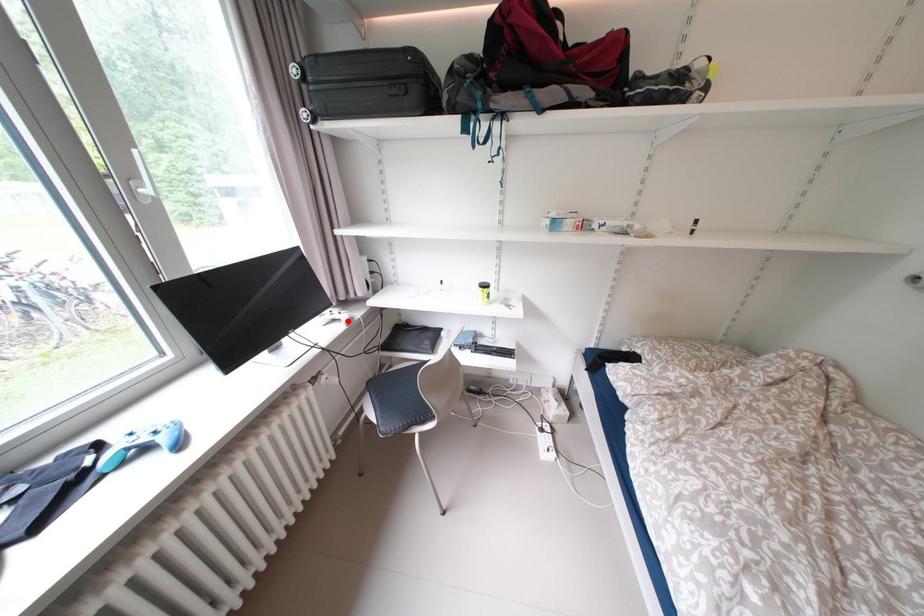
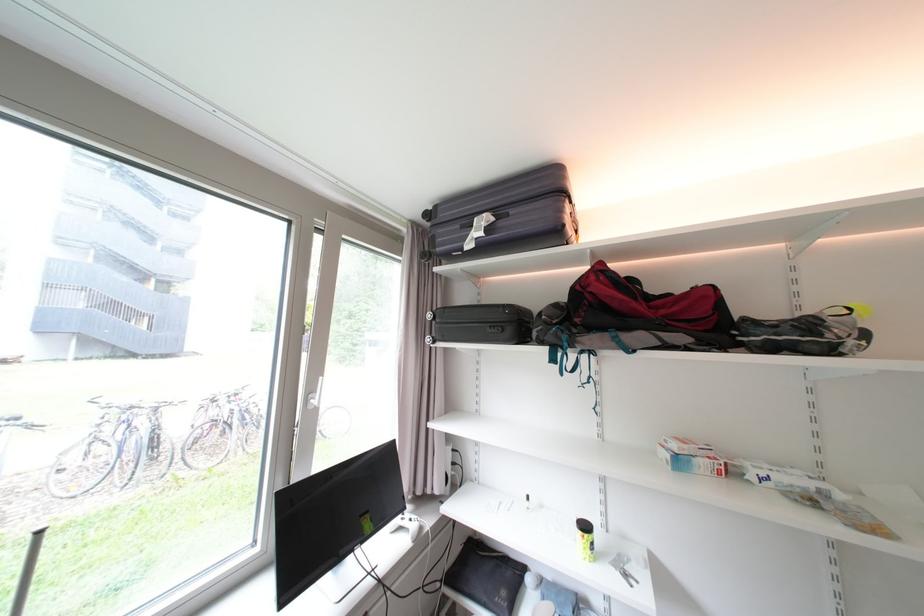
Question: I am providing you with two images of the same scene from different viewpoints. Given a red point in image1, look at the same physical point in image2. Is it:

Choices:
 (A) Closer to the viewpoint
 (B) Farther from the viewpoint

Answer: (B)